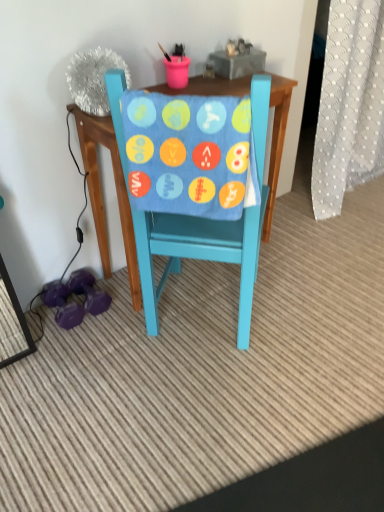
At what (x,y) coordinates should I click in order to perform the action: click on vacant area situated below teal painted wood chair at center (from a real-world perspective). Please return your answer as a coordinate pair (x, y). This screenshot has height=512, width=384. Looking at the image, I should click on (198, 315).